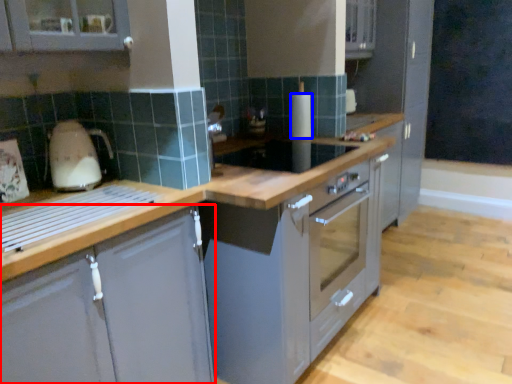
Question: Which of the following is the farthest to the observer, cabinetry (highlighted by a red box) or kitchen appliance (highlighted by a blue box)?

Choices:
 (A) cabinetry
 (B) kitchen appliance

Answer: (B)